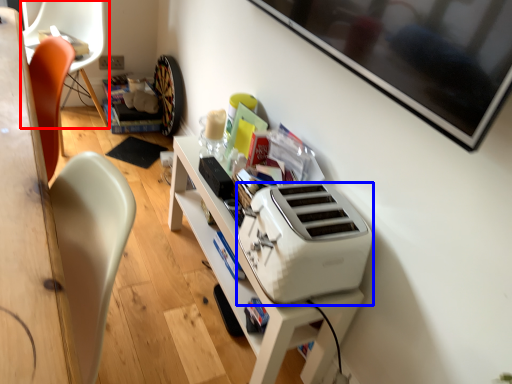
Question: Which object appears farthest to the camera in this image, chair (highlighted by a red box) or home appliance (highlighted by a blue box)?

Choices:
 (A) chair
 (B) home appliance

Answer: (A)